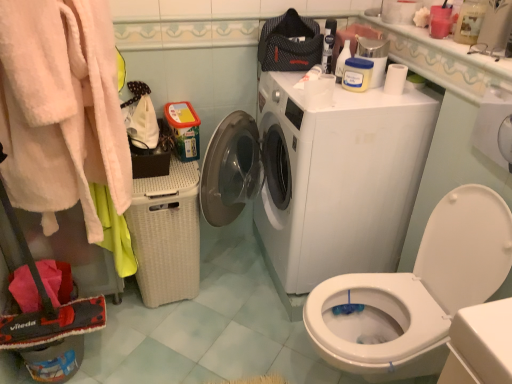
Find the location of a particular element. vacant space to the right of white matte toilet paper at upper right, which appears as the 1th toilet paper when viewed from the left is located at coordinates click(x=355, y=100).